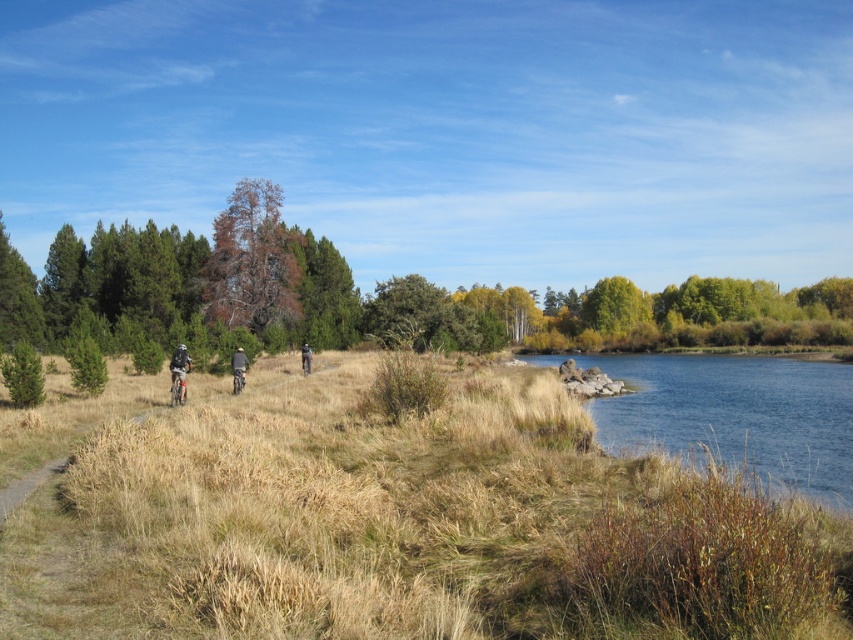
Question: Which of the following is the farthest from the observer?

Choices:
 (A) green matte pine at left
 (B) green leafy tree at center

Answer: (A)

Question: Which of the following is the farthest from the observer?

Choices:
 (A) matte black bicycle at center-left
 (B) brown dry grass at center

Answer: (A)

Question: Which point is farther to the camera?

Choices:
 (A) brown dry grass at center
 (B) green leafy tree at center
 (C) green matte pine at left

Answer: (C)

Question: Does brown textured tree at center appear under green leafy tree at center?

Choices:
 (A) no
 (B) yes

Answer: (A)

Question: Where is brown textured tree at center located in relation to green matte pine at left in the image?

Choices:
 (A) right
 (B) left

Answer: (B)

Question: Is brown/dried wood tree at center to the left of brown textured tree at center from the viewer's perspective?

Choices:
 (A) no
 (B) yes

Answer: (A)